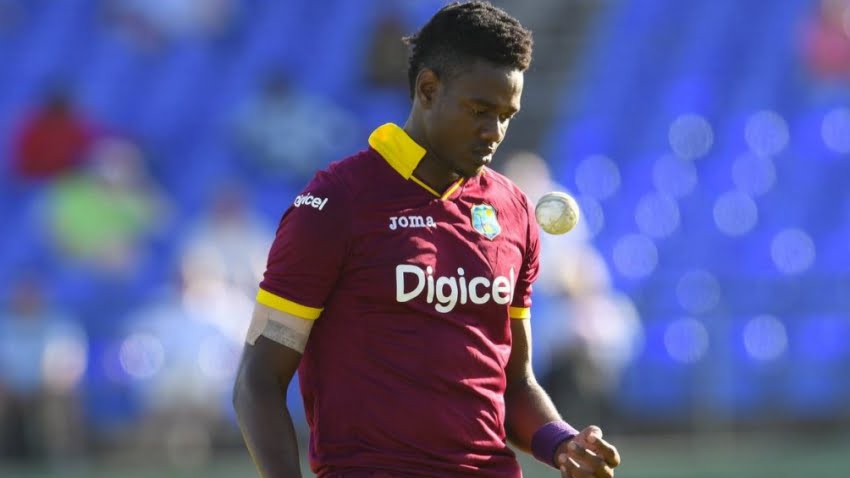
At what (x,y) coordinates should I click in order to perform the action: click on blurred seating area. Please return your answer as a coordinate pair (x, y). Looking at the image, I should click on (676, 76), (672, 104).